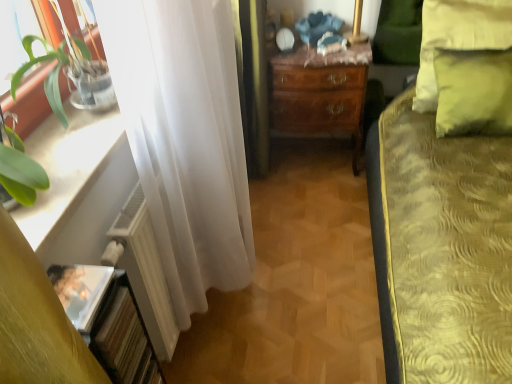
Where is `vacant space underneath white sheer curtain at left (from a real-world perspective)`? vacant space underneath white sheer curtain at left (from a real-world perspective) is located at coordinates (231, 315).